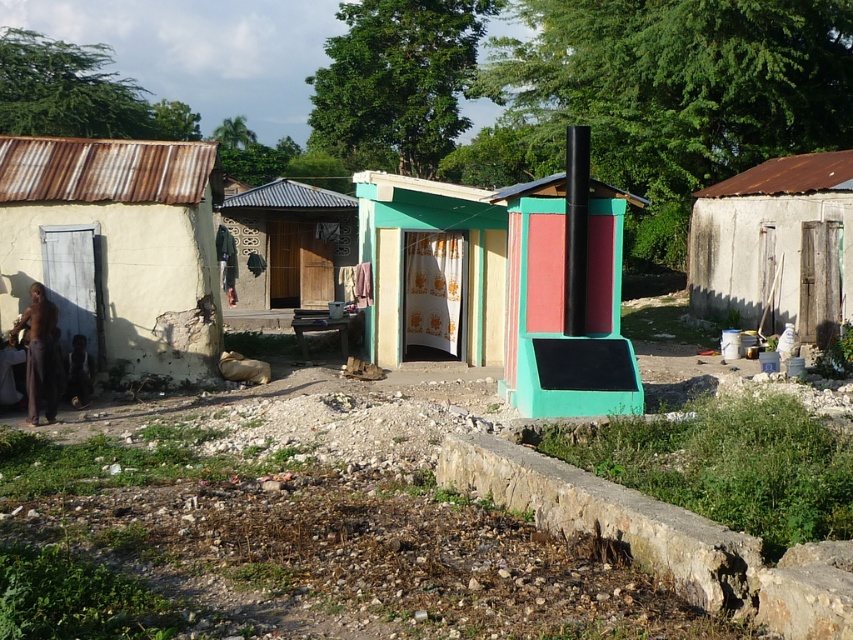
Is white plaster wall at left to the left of stucco wall at center from the viewer's perspective?

In fact, white plaster wall at left is to the right of stucco wall at center.

Who is lower down, white plaster wall at left or stucco wall at center?

Positioned lower is stucco wall at center.

Who is more forward, (67, 244) or (318, 269)?

Positioned in front is point (67, 244).

Image resolution: width=853 pixels, height=640 pixels. Find the location of `white plaster wall at left`. white plaster wall at left is located at coordinates (115, 248).

Can you confirm if rusty metal hut at right is positioned to the left of green painted wood door at center?

No, rusty metal hut at right is not to the left of green painted wood door at center.

Which is in front, point (718, 209) or point (450, 268)?

Point (450, 268) is more forward.

Is point (776, 227) closer to camera compared to point (480, 193)?

No, (776, 227) is further to viewer.

Where is `rusty metal hut at right`? rusty metal hut at right is located at coordinates (776, 244).

Who is positioned more to the left, green painted wood door at center or stucco wall at center?

stucco wall at center is more to the left.

Can you confirm if green painted wood door at center is bigger than stucco wall at center?

Incorrect, green painted wood door at center is not larger than stucco wall at center.

Measure the distance between green painted wood door at center and camera.

green painted wood door at center is 15.31 meters away from camera.

At what (x,y) coordinates should I click in order to perform the action: click on green painted wood door at center. Please return your answer as a coordinate pair (x, y). Looking at the image, I should click on (432, 266).